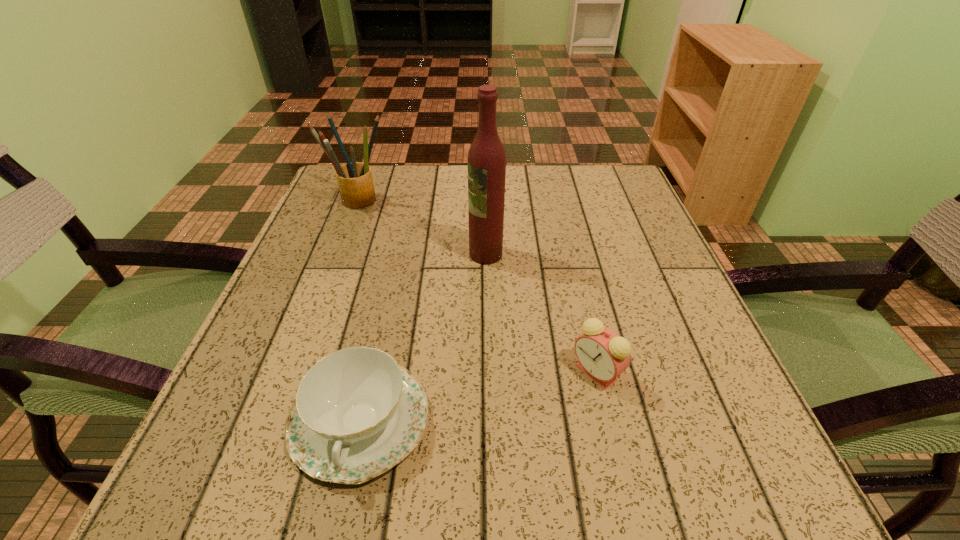
The width and height of the screenshot is (960, 540). I want to click on blank space located on the front of the farthest object, so click(x=348, y=227).

Find the location of a particular element. vacant space located 0.170m on the face of the alarm clock is located at coordinates (460, 373).

At what (x,y) coordinates should I click in order to perform the action: click on free region located 0.290m on the face of the alarm clock. Please return your answer as a coordinate pair (x, y). Image resolution: width=960 pixels, height=540 pixels. Looking at the image, I should click on (381, 373).

Image resolution: width=960 pixels, height=540 pixels. Identify the location of vacant space located on the face of the alarm clock. (315, 373).

Where is `object that is at the far edge`? This screenshot has width=960, height=540. object that is at the far edge is located at coordinates (354, 179).

This screenshot has height=540, width=960. Find the location of `object located at the near edge`. object located at the near edge is located at coordinates click(357, 414).

The width and height of the screenshot is (960, 540). What are the coordinates of `pencil box present at the left edge` in the screenshot? It's located at (354, 179).

This screenshot has height=540, width=960. I want to click on chinaware that is at the left edge, so click(x=357, y=414).

Identify the location of object located in the right edge section of the desktop. (603, 355).

You are a GUI agent. You are given a task and a screenshot of the screen. Output one action in this format:
    pyautogui.click(x=<x>, y=<y>)
    Task: Click on the object that is at the far left corner
    Image resolution: width=960 pixels, height=540 pixels.
    Given the screenshot: What is the action you would take?
    pyautogui.click(x=354, y=179)